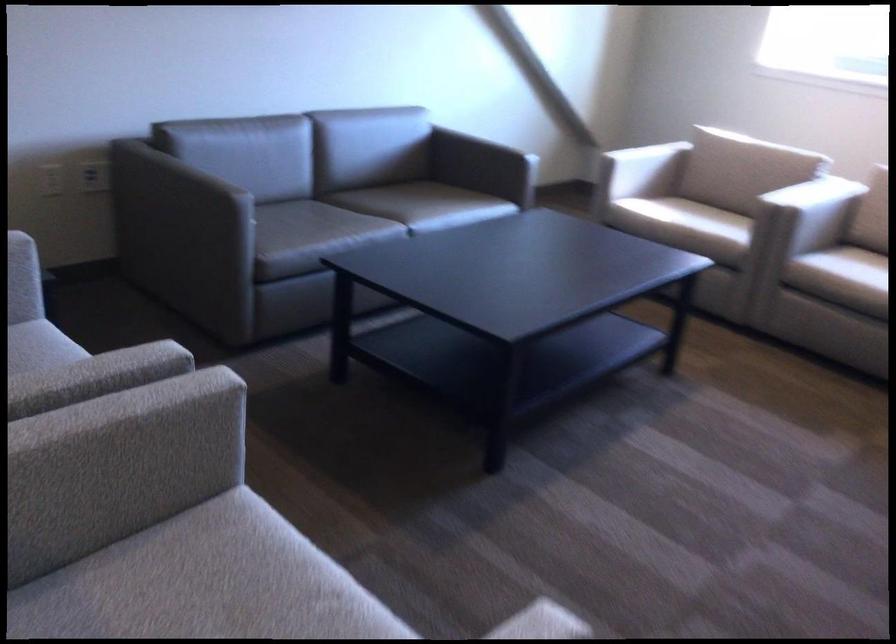
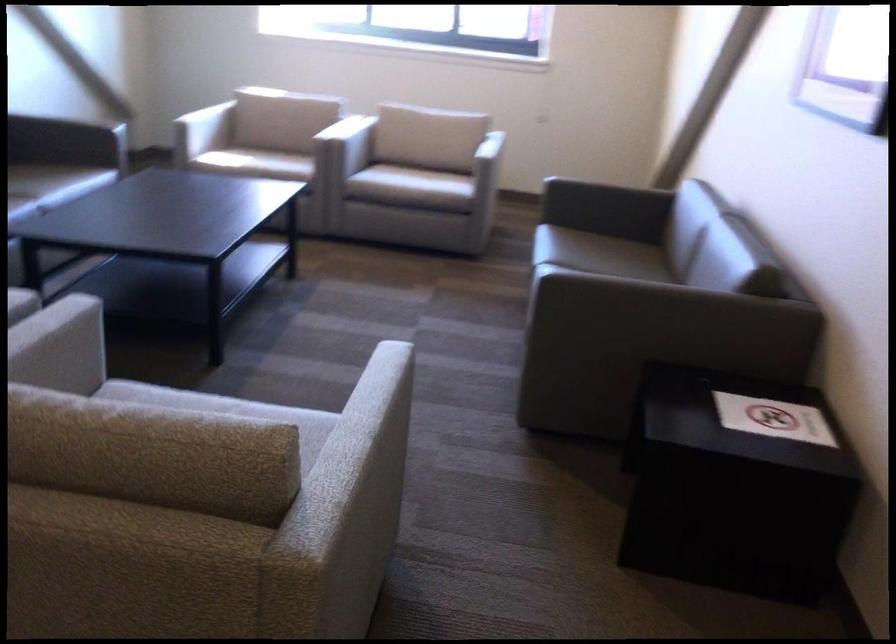
Locate, in the second image, the point that corresponds to [537,563] in the first image.

(279, 406)